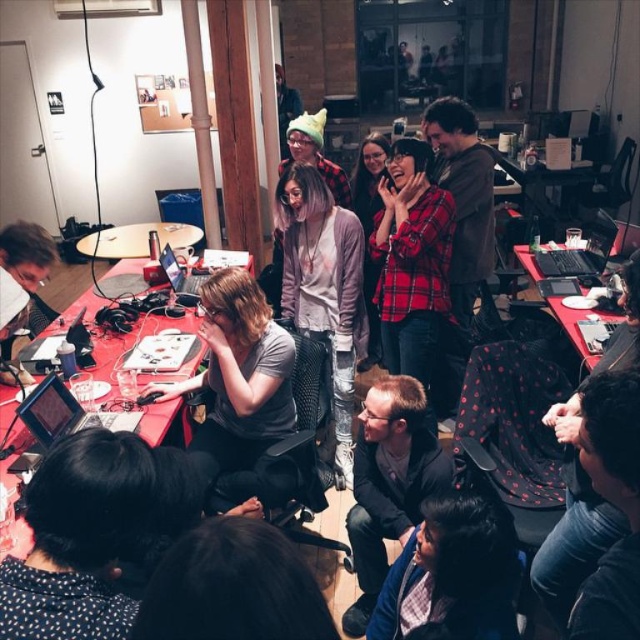
Can you confirm if red plaid shirt at center is wider than black matte laptop at upper right?

Indeed, red plaid shirt at center has a greater width compared to black matte laptop at upper right.

Between point (372, 234) and point (536, 253), which one is positioned in front?

Positioned in front is point (372, 234).

Which is in front, point (426, 212) or point (557, 253)?

Point (426, 212)

Image resolution: width=640 pixels, height=640 pixels. Find the location of `red plaid shirt at center`. red plaid shirt at center is located at coordinates (412, 264).

Which is in front, point (420, 548) or point (552, 312)?

Point (420, 548)

Measure the distance between point (484, 566) and camera.

4.66 feet

Measure the distance between dark blue fabric jacket at lower center and camera.

The distance of dark blue fabric jacket at lower center from camera is 4.63 feet.

The image size is (640, 640). Find the location of `dark blue fabric jacket at lower center`. dark blue fabric jacket at lower center is located at coordinates (452, 572).

From the picture: Who is higher up, red plaid shirt at center or matte black laptop at center?

matte black laptop at center is above.

Who is more distant from viewer, (410, 202) or (195, 280)?

The point (195, 280) is more distant.

Describe the element at coordinates (412, 264) in the screenshot. The image size is (640, 640). I see `red plaid shirt at center` at that location.

This screenshot has width=640, height=640. In order to click on red plaid shirt at center in this screenshot , I will do `click(412, 264)`.